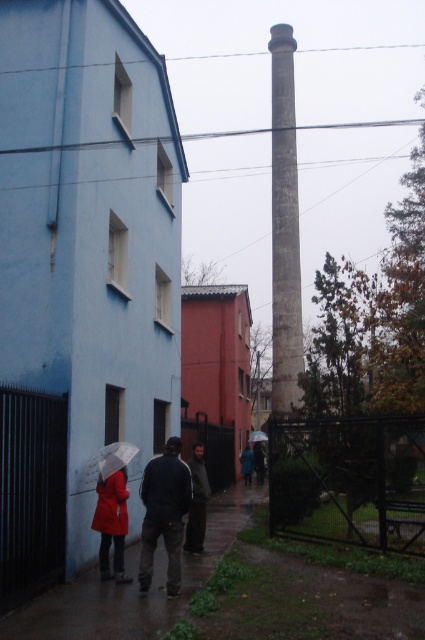
Can you confirm if dark gray jacket at center is taller than transparent plastic umbrella at center?

Correct, dark gray jacket at center is much taller as transparent plastic umbrella at center.

Find the location of `dark gray jacket at center`. dark gray jacket at center is located at coordinates 258,461.

I want to click on dark gray jacket at center, so click(x=258, y=461).

Image resolution: width=425 pixels, height=640 pixels. Identify the location of dark gray jacket at center. (258, 461).

Can you confirm if matte red coat at center is smaller than dark gray fabric jacket at center?

Yes.

In the scene shown: Can you confirm if matte red coat at center is positioned to the right of dark gray fabric jacket at center?

Incorrect, matte red coat at center is not on the right side of dark gray fabric jacket at center.

Which is behind, point (119, 513) or point (189, 531)?

Positioned behind is point (189, 531).

You are a GUI agent. You are given a task and a screenshot of the screen. Output one action in this format:
    pyautogui.click(x=<x>, y=<y>)
    Task: Click on the matte red coat at center
    The width and height of the screenshot is (425, 640).
    Given the screenshot: What is the action you would take?
    pyautogui.click(x=164, y=513)

Can you confirm if white matte umbrella at lower left is positioned to the right of blue fabric jacket at center?

In fact, white matte umbrella at lower left is to the left of blue fabric jacket at center.

Is white matte umbrella at lower left positioned at the back of blue fabric jacket at center?

No, white matte umbrella at lower left is closer to the viewer.

What do you see at coordinates (108, 460) in the screenshot? Image resolution: width=425 pixels, height=640 pixels. I see `white matte umbrella at lower left` at bounding box center [108, 460].

Image resolution: width=425 pixels, height=640 pixels. Find the location of `white matte umbrella at lower left`. white matte umbrella at lower left is located at coordinates (108, 460).